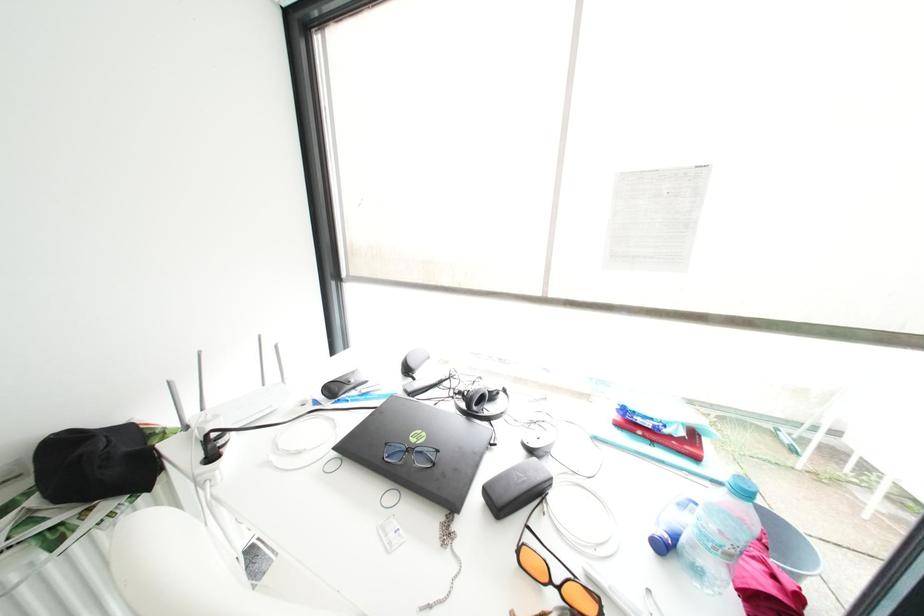
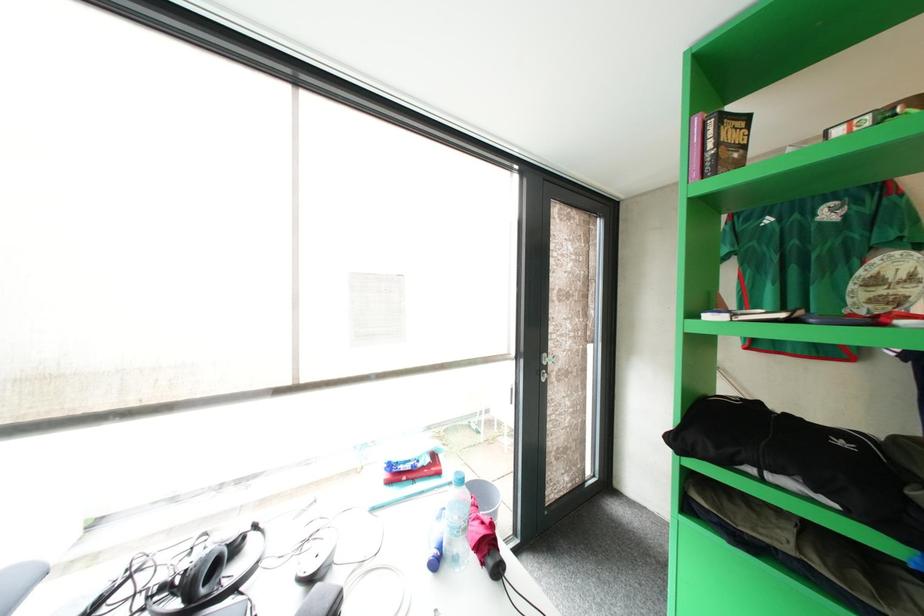
Question: The camera is either moving clockwise (left) or counter-clockwise (right) around the object. The first image is from the beginning of the video and the second image is from the end. Is the camera moving left or right when shooting the video?

Choices:
 (A) Left
 (B) Right

Answer: (A)